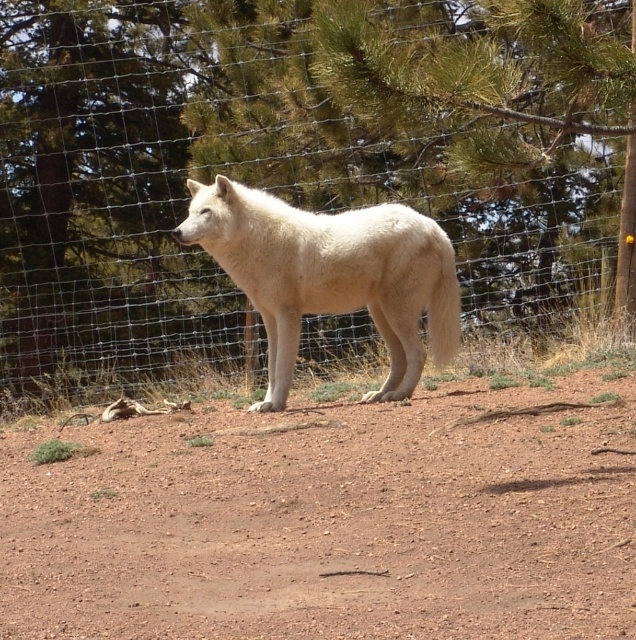
You are a photographer trying to capture the white fur wolf at center through the wire mesh fence at center. Since the fence is in the way, will you need to adjust your position to get a clear shot of the wolf?

The wire mesh fence at center is above the white fur wolf at center, so you can lower your camera to avoid the fence and capture the wolf clearly without needing to move the fence itself.

From the picture: You are a hiker who wants to follow the brown dirt track at center to reach a cabin located behind the wire fence in the background. However, there is a white fur wolf at center blocking your path. According to the image, is the wolf standing on the dirt track or in front of it?

The brown dirt track at center is below the white fur wolf at center, meaning the wolf is standing on the dirt track.